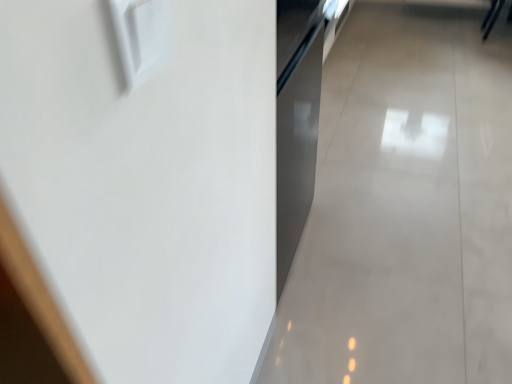
Question: Should I look upward or downward to see white glossy wall at upper left?

Choices:
 (A) up
 (B) down

Answer: (A)